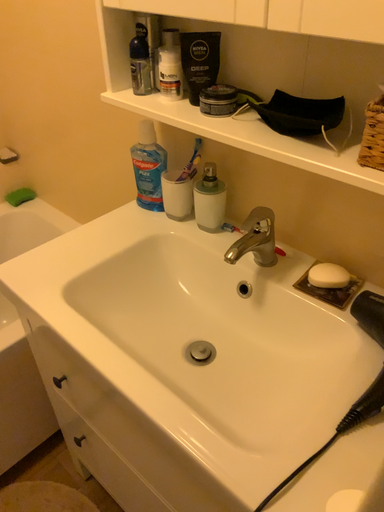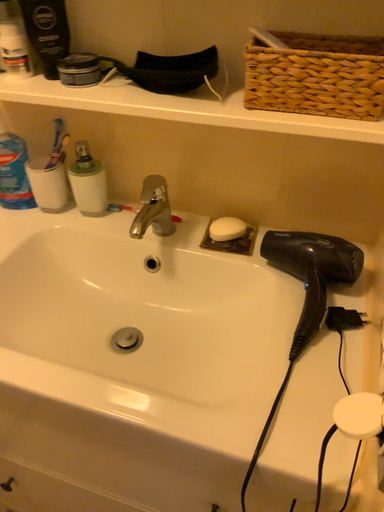
Question: Which way did the camera rotate in the video?

Choices:
 (A) rotated left
 (B) rotated right

Answer: (B)